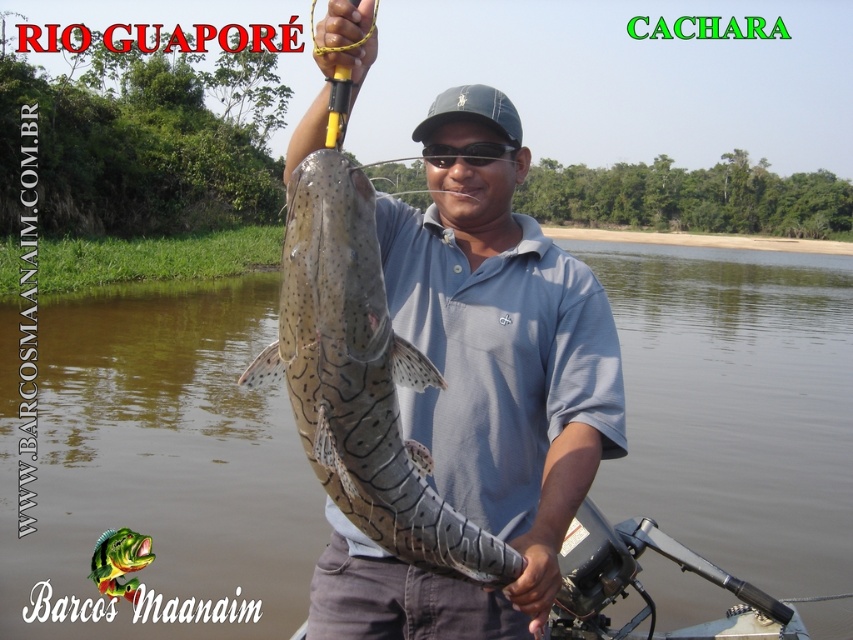
Locate an element on the screen. The height and width of the screenshot is (640, 853). brown water at center is located at coordinates (160, 458).

This screenshot has height=640, width=853. In order to click on brown water at center in this screenshot , I will do pyautogui.click(x=160, y=458).

Locate an element on the screen. brown water at center is located at coordinates (160, 458).

Is brown water at center positioned behind speckled skin catfish at center?

Yes, it is.

Measure the distance from brown water at center to speckled skin catfish at center.

brown water at center is 13.52 meters from speckled skin catfish at center.

The image size is (853, 640). Identify the location of brown water at center. (160, 458).

I want to click on brown water at center, so click(x=160, y=458).

Does matte blue shirt at center appear on the left side of speckled skin catfish at center?

No, matte blue shirt at center is not to the left of speckled skin catfish at center.

Is matte blue shirt at center bigger than speckled skin catfish at center?

Correct, matte blue shirt at center is larger in size than speckled skin catfish at center.

Which is behind, point (451, 182) or point (357, 474)?

Point (451, 182)

Where is `matte blue shirt at center`? matte blue shirt at center is located at coordinates (482, 385).